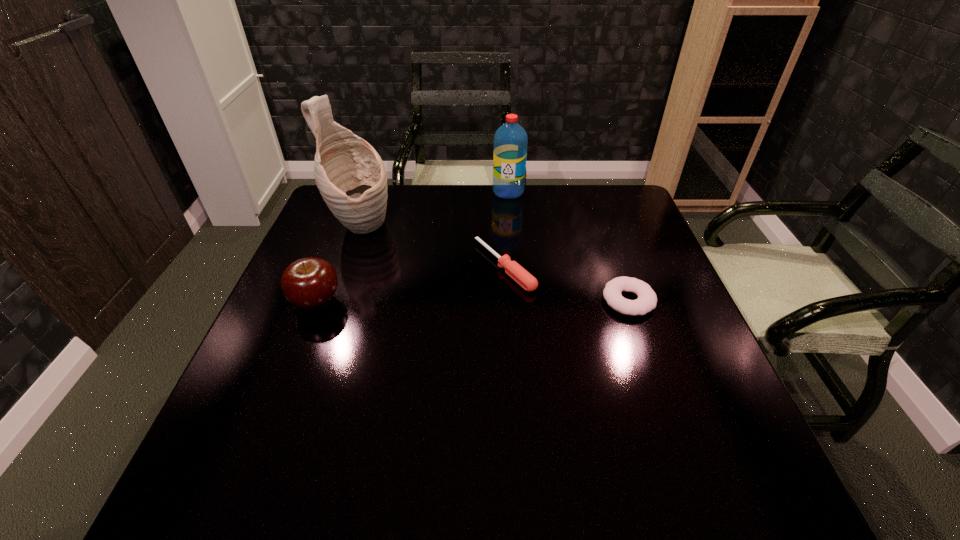
Locate an element on the screen. This screenshot has width=960, height=540. object that is the fourth closest one to the rightmost object is located at coordinates (310, 283).

You are a GUI agent. You are given a task and a screenshot of the screen. Output one action in this format:
    pyautogui.click(x=<x>, y=<y>)
    Task: Click on the object that is the third closest to the tallest object
    Image resolution: width=960 pixels, height=540 pixels.
    Given the screenshot: What is the action you would take?
    pyautogui.click(x=510, y=140)

Locate an element on the screen. The height and width of the screenshot is (540, 960). free spot that satisfies the following two spatial constraints: 1. on the back side of the apple; 2. on the left side of the screwdriver is located at coordinates (329, 266).

Find the location of `free location that satisfies the following two spatial constraints: 1. on the back side of the pitcher; 2. on the left side of the apple`. free location that satisfies the following two spatial constraints: 1. on the back side of the pitcher; 2. on the left side of the apple is located at coordinates (345, 228).

Locate an element on the screen. Image resolution: width=960 pixels, height=540 pixels. vacant space that satisfies the following two spatial constraints: 1. on the front side of the rightmost object; 2. on the left side of the screwdriver is located at coordinates (507, 300).

Locate an element on the screen. This screenshot has width=960, height=540. free spot that satisfies the following two spatial constraints: 1. on the front side of the farthest object; 2. on the left side of the doughnut is located at coordinates (518, 300).

Locate an element on the screen. Image resolution: width=960 pixels, height=540 pixels. free space that satisfies the following two spatial constraints: 1. on the front side of the rightmost object; 2. on the right side of the water bottle is located at coordinates (518, 300).

I want to click on free region that satisfies the following two spatial constraints: 1. on the back side of the apple; 2. on the left side of the rightmost object, so click(317, 300).